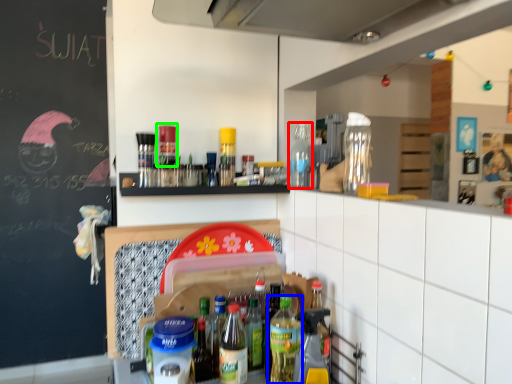
Question: Considering the real-world distances, which object is closest to bottle (highlighted by a red box)? bottle (highlighted by a blue box) or bottle (highlighted by a green box).

Choices:
 (A) bottle
 (B) bottle

Answer: (B)